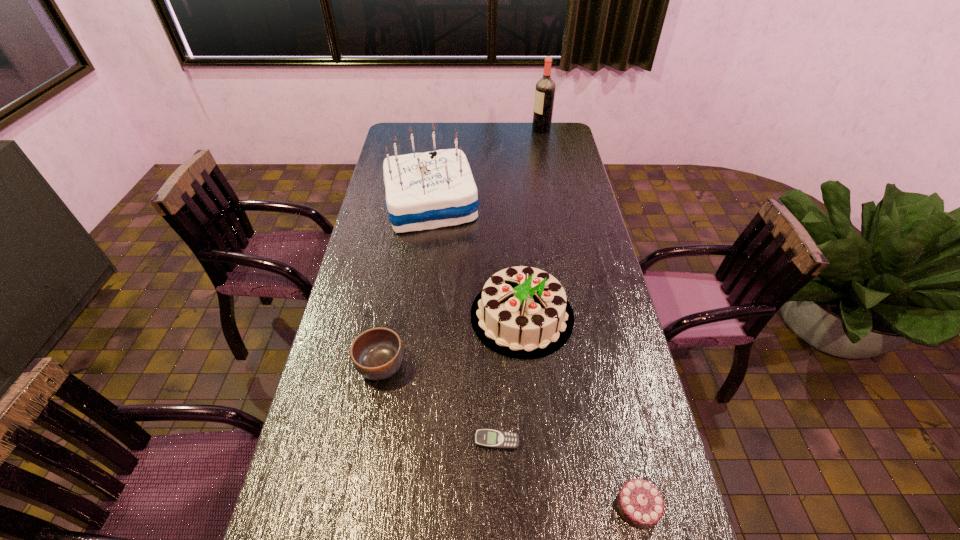
Where is `the second nearest object`? the second nearest object is located at coordinates (486, 438).

You are a GUI agent. You are given a task and a screenshot of the screen. Output one action in this format:
    pyautogui.click(x=<x>, y=<y>)
    Task: Click on the vacant space located 0.330m on the front-facing side of the farthest object
    
    Given the screenshot: What is the action you would take?
    pyautogui.click(x=466, y=129)

Locate an element on the screen. The image size is (960, 540). vacant space located on the front-facing side of the farthest object is located at coordinates pyautogui.click(x=504, y=129).

Where is `free space located 0.060m on the front-facing side of the farthest object`? This screenshot has width=960, height=540. free space located 0.060m on the front-facing side of the farthest object is located at coordinates (520, 129).

This screenshot has height=540, width=960. I want to click on free region located on the back of the taller birthday cake, so coord(440,136).

Find the location of a particular element. This screenshot has height=540, width=960. free space located 0.310m on the back of the third tallest object is located at coordinates (514, 221).

I want to click on free space located on the front of the fourth tallest object, so click(365, 460).

This screenshot has width=960, height=540. I want to click on vacant space positioned on the back of the nearest object, so click(x=607, y=373).

Find the location of a particular element. blank space located on the left of the shortest object is located at coordinates (338, 441).

The width and height of the screenshot is (960, 540). In order to click on object present at the far edge in this screenshot , I will do click(x=545, y=88).